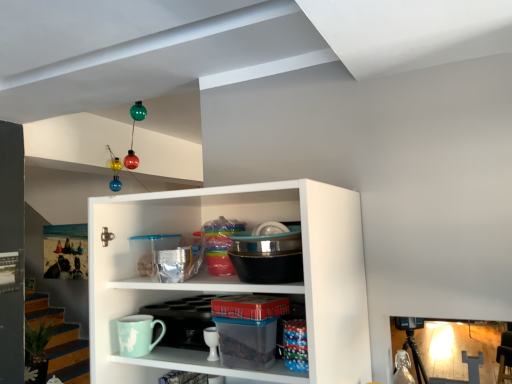
Question: Considering the relative positions of clear plastic container at center and mint matte mug at lower center in the image provided, is clear plastic container at center to the left or to the right of mint matte mug at lower center?

Choices:
 (A) right
 (B) left

Answer: (A)

Question: From a real-world perspective, is clear plastic container at center positioned above or below mint matte mug at lower center?

Choices:
 (A) above
 (B) below

Answer: (A)

Question: In terms of width, does clear plastic container at center look wider or thinner when compared to mint matte mug at lower center?

Choices:
 (A) thin
 (B) wide

Answer: (B)

Question: Would you say mint matte mug at lower center is inside or outside clear plastic container at center?

Choices:
 (A) inside
 (B) outside

Answer: (B)

Question: Is mint matte mug at lower center in front of or behind clear plastic container at center in the image?

Choices:
 (A) behind
 (B) front

Answer: (A)

Question: Considering the positions of point (156, 319) and point (243, 370), is point (156, 319) closer or farther from the camera than point (243, 370)?

Choices:
 (A) farther
 (B) closer

Answer: (A)

Question: Looking at their shapes, would you say mint matte mug at lower center is wider or thinner than clear plastic container at center?

Choices:
 (A) thin
 (B) wide

Answer: (A)